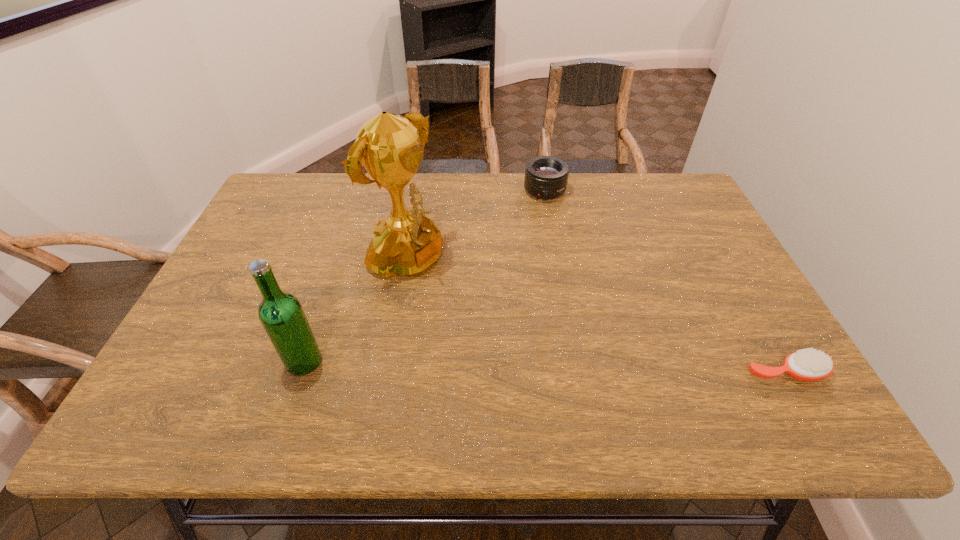
Find the location of a particular element. This screenshot has width=960, height=540. the second tallest object is located at coordinates click(281, 314).

Where is `the leftmost object`? Image resolution: width=960 pixels, height=540 pixels. the leftmost object is located at coordinates (281, 314).

Where is `the shortest object`? The width and height of the screenshot is (960, 540). the shortest object is located at coordinates (808, 364).

I want to click on the rightmost object, so click(808, 364).

Locate an element on the screen. Image resolution: width=960 pixels, height=540 pixels. the tallest object is located at coordinates [389, 146].

In order to click on award in this screenshot , I will do `click(389, 146)`.

The height and width of the screenshot is (540, 960). Find the location of `the second shortest object`. the second shortest object is located at coordinates (546, 177).

Identify the location of telephoto lens. (546, 177).

Where is `free space located on the back of the beer bottle`? This screenshot has width=960, height=540. free space located on the back of the beer bottle is located at coordinates (315, 329).

Identify the location of vacant space located 0.380m on the back of the hairbrush. This screenshot has width=960, height=540. (713, 246).